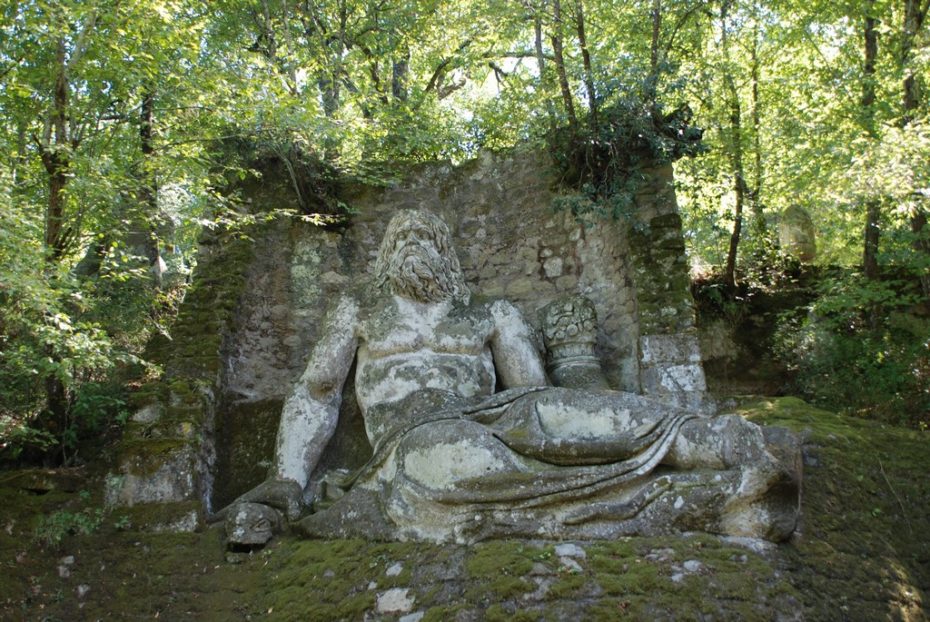
Identify the location of brick wall. (530, 230).